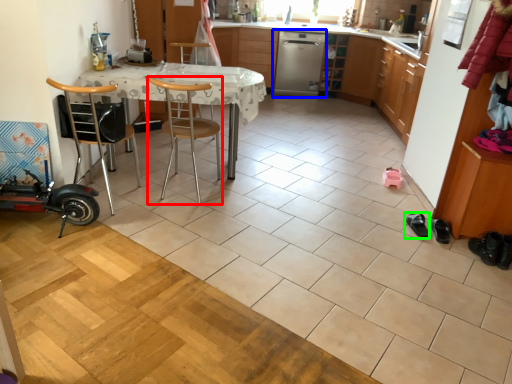
Question: Estimate the real-world distances between objects in this image. Which object is closer to chair (highlighted by a red box), dish washer (highlighted by a blue box) or footwear (highlighted by a green box)?

Choices:
 (A) dish washer
 (B) footwear

Answer: (B)